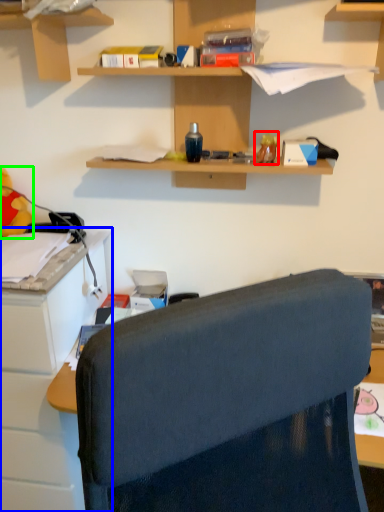
Question: Which object is the farthest from toy (highlighted by a red box)? Choose among these: cabinetry (highlighted by a blue box) or toy (highlighted by a green box).

Choices:
 (A) cabinetry
 (B) toy

Answer: (A)